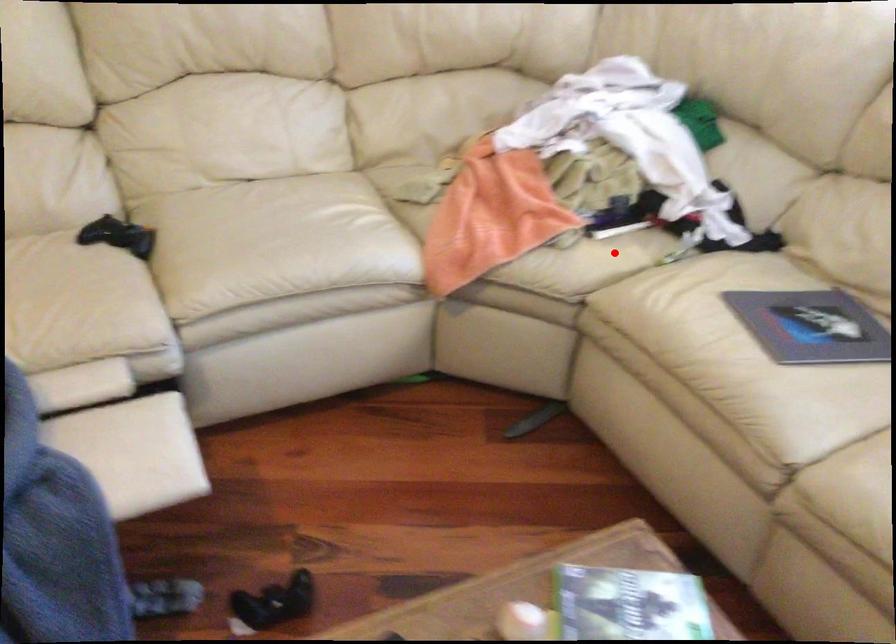
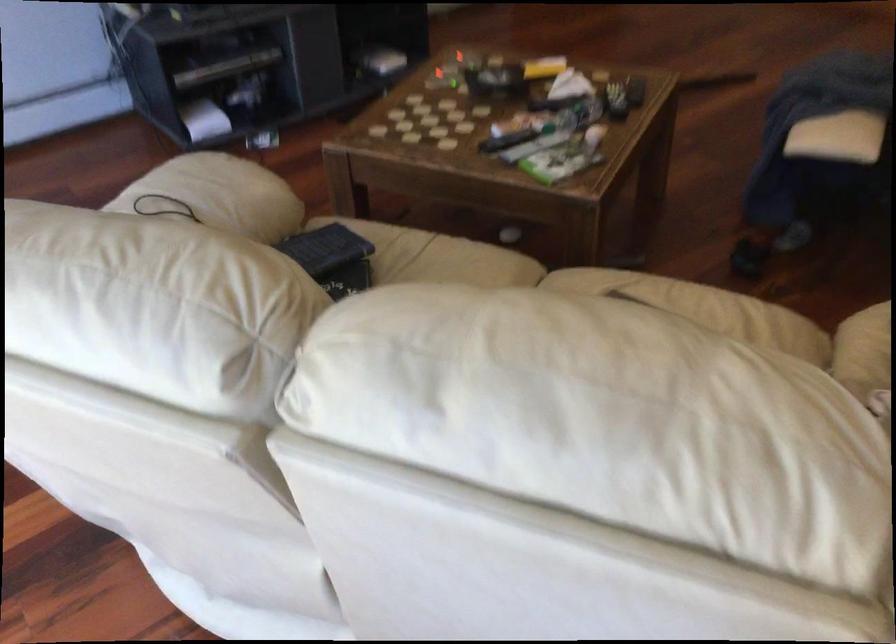
Where in the second image is the point corresponding to the highlighted location from the first image?

(864, 351)